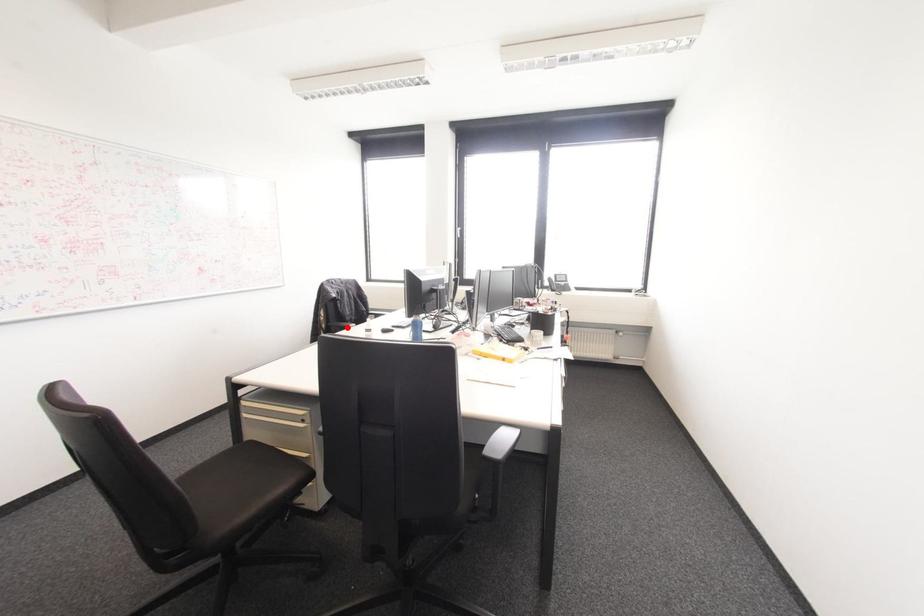
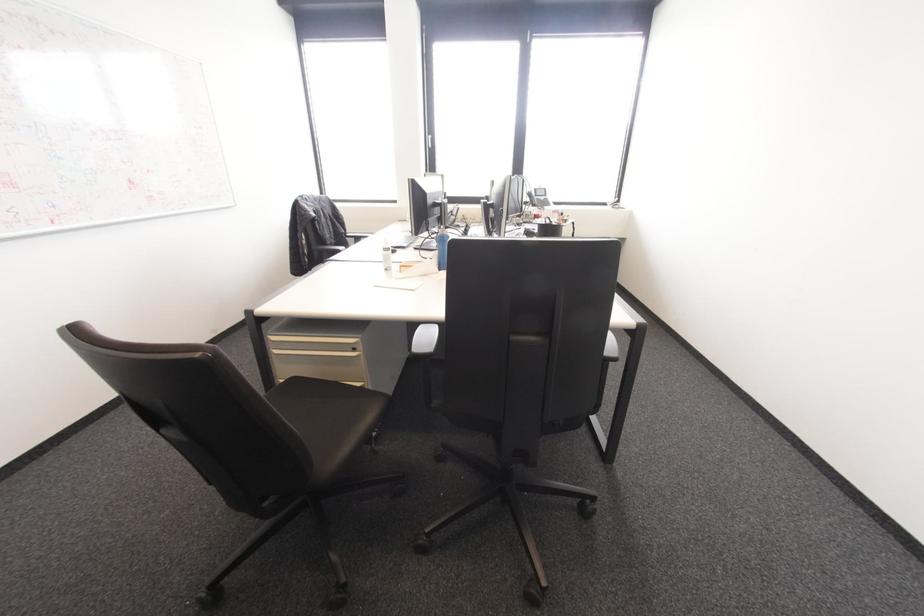
The point at the highlighted location is marked in the first image. Where is the corresponding point in the second image?

(337, 251)